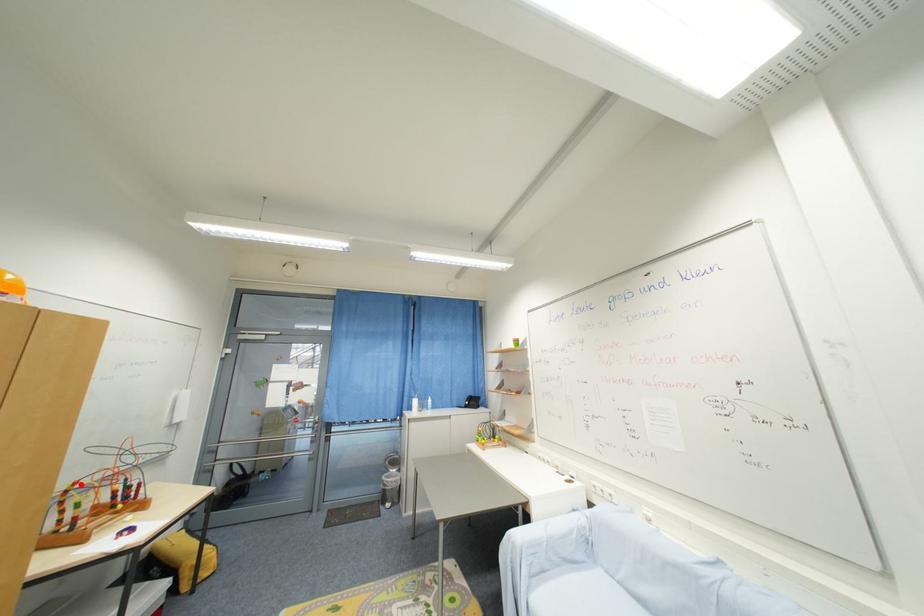
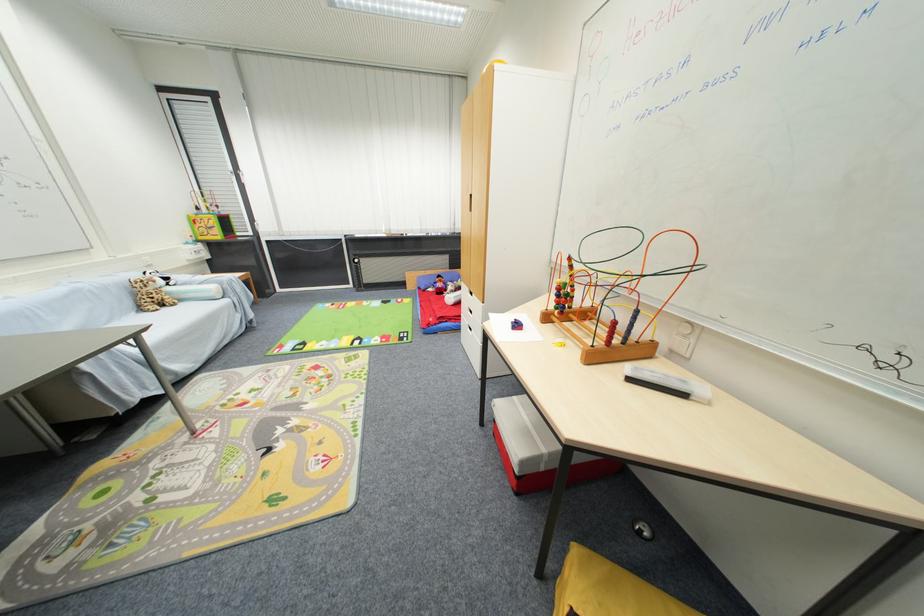
Question: I am providing you with two images of the same scene from different viewpoints. A red point is shown in image1. For the corresponding object point in image2, is it positioned nearer or farther from the camera?

Choices:
 (A) Nearer
 (B) Farther

Answer: (A)